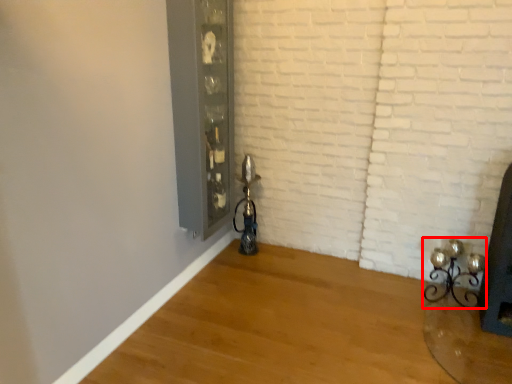
Question: From the image's perspective, where is candle holder (annotated by the red box) located relative to glass door?

Choices:
 (A) above
 (B) below

Answer: (B)